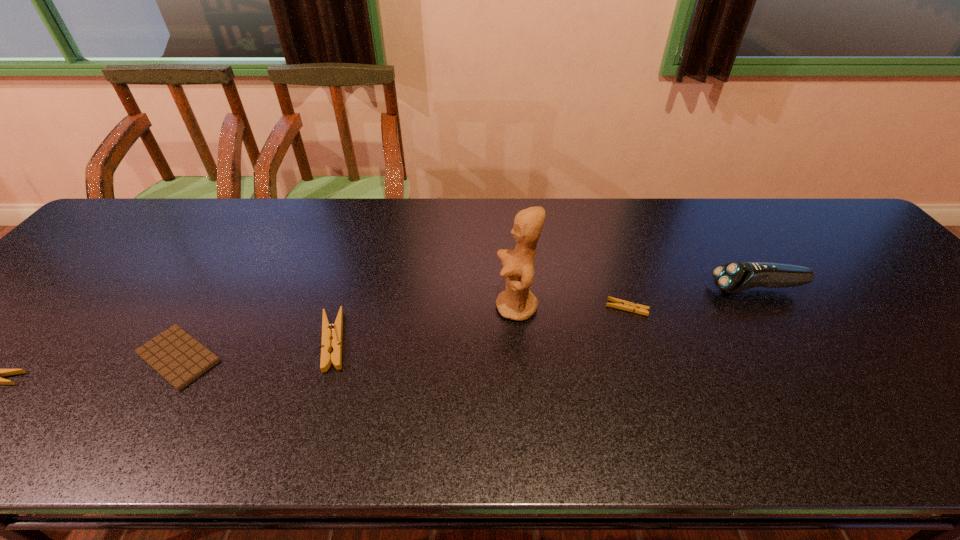
Identify the location of chocolate bar positioned at the near edge. (179, 358).

Image resolution: width=960 pixels, height=540 pixels. Identify the location of free spot at the far edge of the desktop. (640, 201).

You are a GUI agent. You are given a task and a screenshot of the screen. Output one action in this format:
    pyautogui.click(x=<x>, y=<y>)
    Task: Click on the free region at the near edge of the desktop
    The height and width of the screenshot is (540, 960).
    Given the screenshot: What is the action you would take?
    pyautogui.click(x=818, y=392)

Locate an element on the screen. free area in between the second shortest object and the second clothespin from right to left is located at coordinates (480, 325).

The width and height of the screenshot is (960, 540). Identify the location of free spot between the tallest clothespin and the chocolate bar. (255, 349).

Where is `vacant area between the shortest clothespin and the second clothespin from right to left`? This screenshot has height=540, width=960. vacant area between the shortest clothespin and the second clothespin from right to left is located at coordinates (480, 325).

The image size is (960, 540). What are the coordinates of `vacant space that is in between the fifth tallest object and the second tallest object` in the screenshot? It's located at (692, 299).

Identify the location of free spot between the shortest object and the electric shaver. Image resolution: width=960 pixels, height=540 pixels. (468, 323).

Where is `the fifth closest object relative to the second object from right to left`? the fifth closest object relative to the second object from right to left is located at coordinates (0, 373).

Locate an element on the screen. the closest object to the figurine is located at coordinates (618, 303).